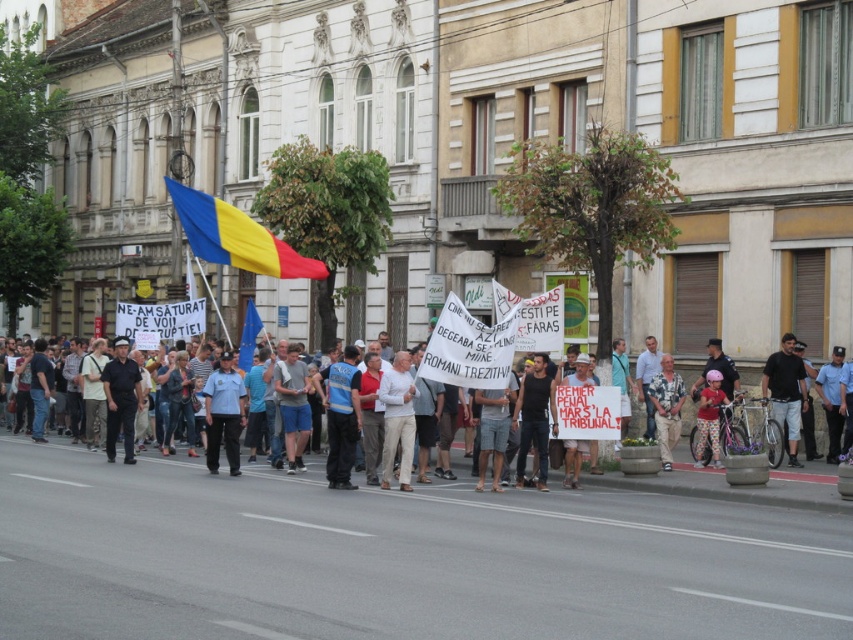
You are a journalist trying to capture the protest scene. You notice two individuals in the crowd wearing a light blue uniform at center and a light brown shirt at center. Which one is positioned more to the left side of the other?

The light blue uniform at center is positioned on the left side of light brown shirt at center.

You are a photographer trying to capture a clear shot of the protest. You notice two individuals in the crowd wearing a black cotton shirt at right and a dark blue uniform at center. Which individual would require a wider lens to capture their entire clothing from your current position?

The black cotton shirt at right requires a wider lens because its width is larger than the dark blue uniform at center, making it necessary to capture more of the scene to include the entire clothing.

You are a journalist covering the protest. You need to describe the size comparison between the blue uniform at center and the black cotton shirt at right in your report. How would you phrase this?

The blue uniform at center is smaller than the black cotton shirt at right.